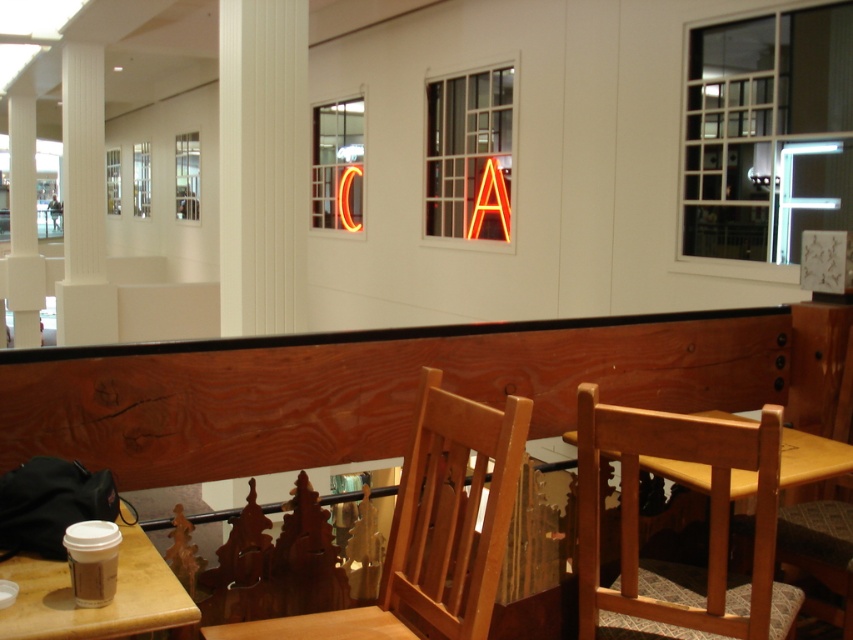
Does brown paper cup at lower left come behind neon orange letter a at center?

No, brown paper cup at lower left is closer to the viewer.

Between point (84, 600) and point (485, 172), which one is positioned in front?

Point (84, 600)

Does point (113, 548) come behind point (498, 172)?

No, it is in front of (498, 172).

Locate an element on the screen. The width and height of the screenshot is (853, 640). brown paper cup at lower left is located at coordinates (x=91, y=561).

Does point (498, 525) come in front of point (86, 554)?

No.

Is point (403, 620) in front of point (68, 548)?

No.

Identify the location of wooden chair at center. (431, 531).

Is matte brown table at lower left below white smooth pillar at left?

Yes, matte brown table at lower left is below white smooth pillar at left.

Who is more forward, (55, 582) or (26, 284)?

Point (55, 582)

Between point (91, 636) and point (22, 115), which one is positioned in front?

Point (91, 636) is in front.

Identify the location of matte brown table at lower left. (96, 608).